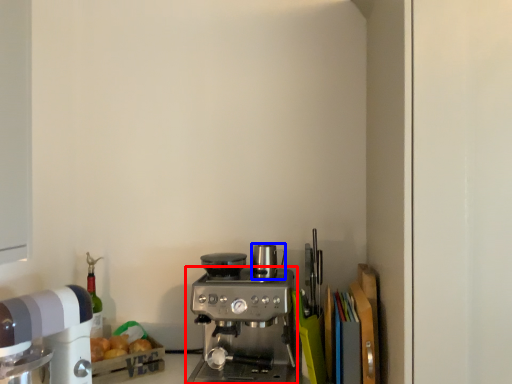
Question: Which object appears closest to the camera in this image, coffee maker (highlighted by a red box) or appliance (highlighted by a blue box)?

Choices:
 (A) coffee maker
 (B) appliance

Answer: (A)